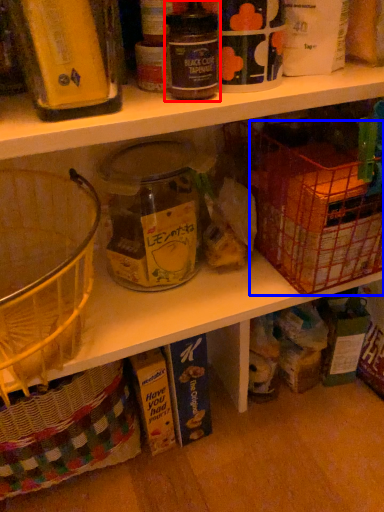
Question: Which object appears closest to the camera in this image, bottle (highlighted by a red box) or basket (highlighted by a blue box)?

Choices:
 (A) bottle
 (B) basket

Answer: (A)